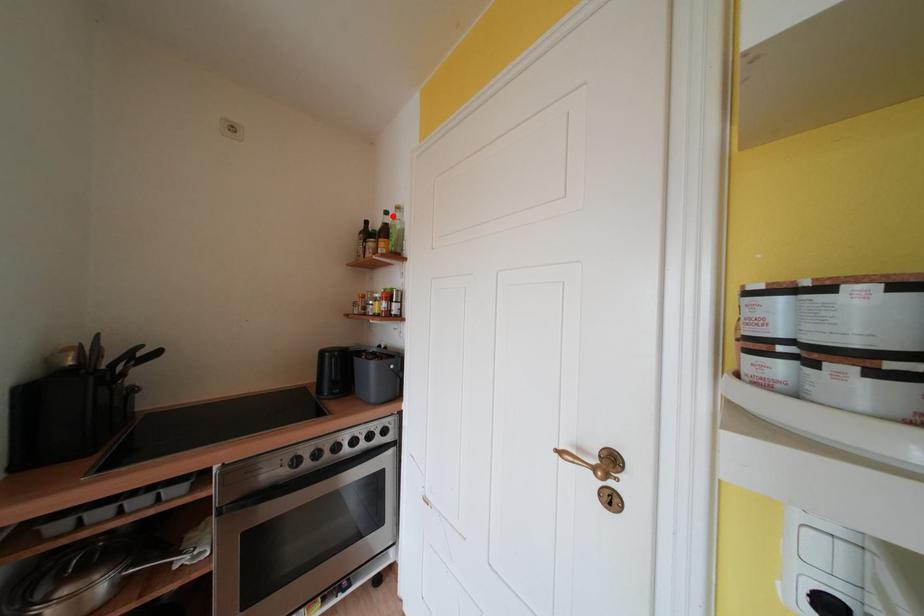
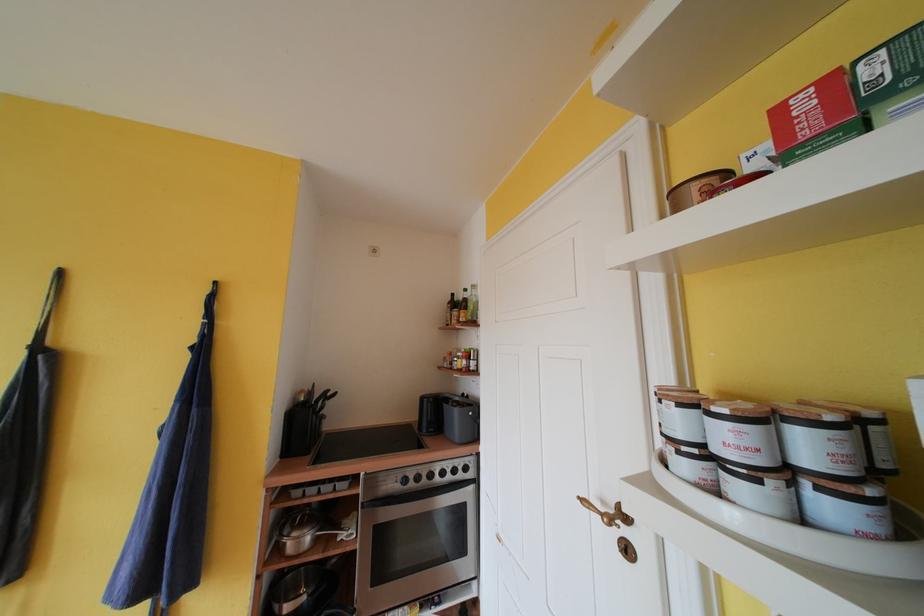
In the second image, find the point that corresponds to the highlighted location in the first image.

(471, 294)